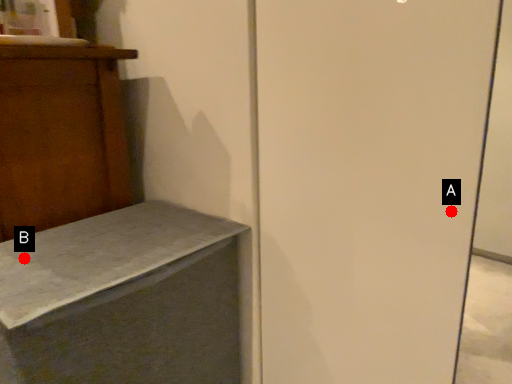
Question: Two points are circled on the image, labeled by A and B beside each circle. Which point is further to the camera?

Choices:
 (A) A is further
 (B) B is further

Answer: (B)